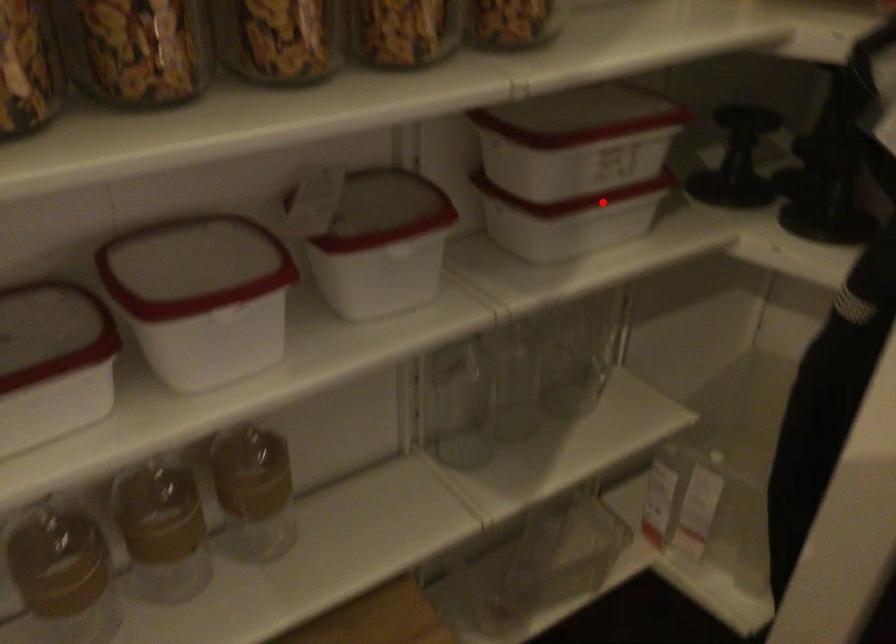
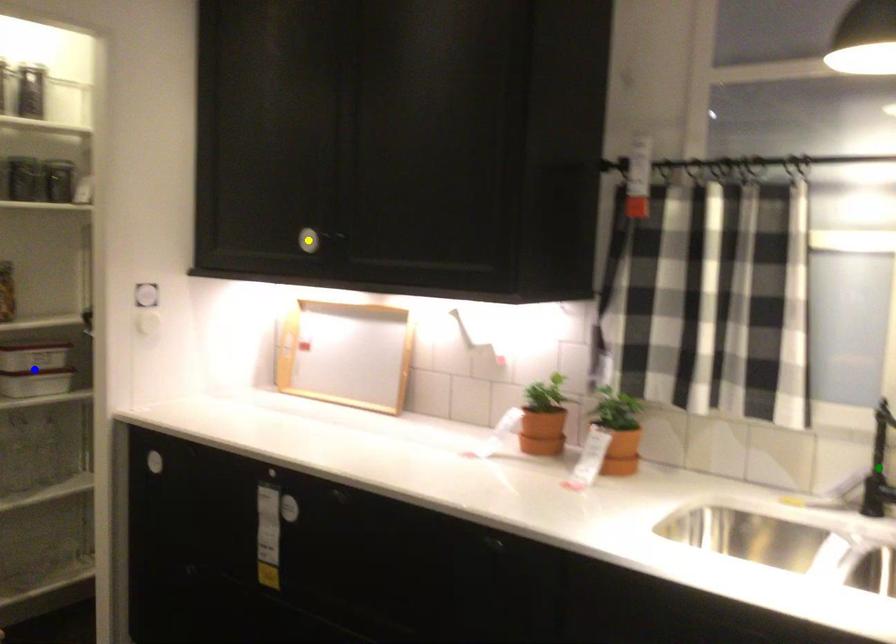
Question: I am providing you with two images of the same scene from different viewpoints. A red point is marked on the first image. You are given multiple points on the second image. Which mark in image 2 goes with the point in image 1?

Choices:
 (A) yellow point
 (B) green point
 (C) blue point

Answer: (C)